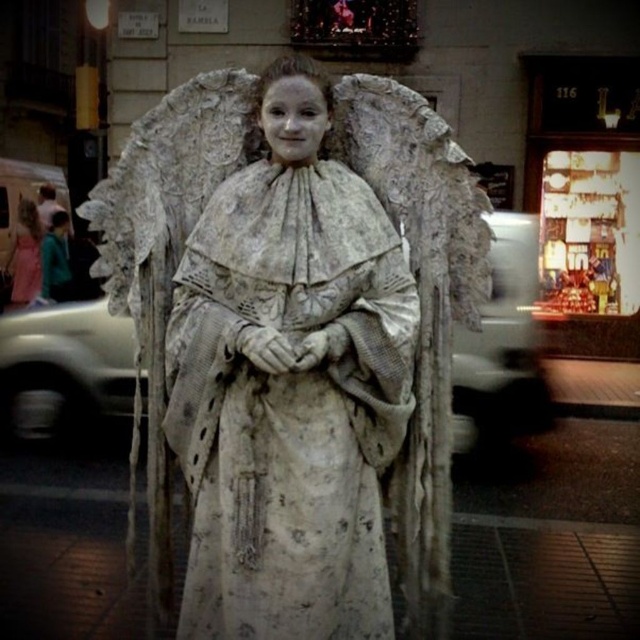
Question: Can you confirm if white paper-like wings at center is positioned below teal fabric jacket at left?

Choices:
 (A) yes
 (B) no

Answer: (A)

Question: Which object is closer to the camera taking this photo?

Choices:
 (A) matte white dress at left
 (B) teal fabric jacket at left
 (C) white paper-like wings at center

Answer: (C)

Question: Is white paper-like wings at center further to the viewer compared to teal fabric jacket at left?

Choices:
 (A) no
 (B) yes

Answer: (A)

Question: Considering the real-world distances, which object is farthest from the teal fabric jacket at left?

Choices:
 (A) matte white dress at left
 (B) white paper-like wings at center

Answer: (B)

Question: Does white paper-like wings at center appear over matte white dress at left?

Choices:
 (A) yes
 (B) no

Answer: (B)

Question: Which of the following is the closest to the observer?

Choices:
 (A) matte white dress at left
 (B) white paper-like wings at center
 (C) teal fabric jacket at left

Answer: (B)